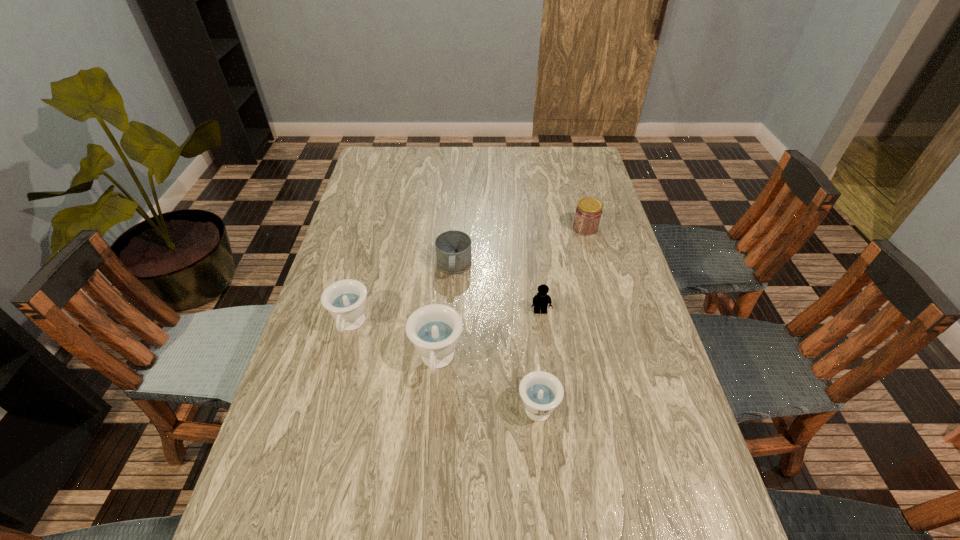
The width and height of the screenshot is (960, 540). In order to click on the leftmost object in this screenshot , I will do `click(345, 300)`.

You are a GUI agent. You are given a task and a screenshot of the screen. Output one action in this format:
    pyautogui.click(x=<x>, y=<y>)
    Task: Click on the second tallest teacup
    
    Given the screenshot: What is the action you would take?
    pyautogui.click(x=345, y=300)

Image resolution: width=960 pixels, height=540 pixels. I want to click on the second teacup from left to right, so click(434, 329).

Where is `the shortest teacup`? The width and height of the screenshot is (960, 540). the shortest teacup is located at coordinates (541, 392).

I want to click on Lego, so click(540, 301).

I want to click on jam, so click(588, 213).

Locate an element on the screen. The width and height of the screenshot is (960, 540). the rightmost object is located at coordinates (588, 213).

The width and height of the screenshot is (960, 540). I want to click on the fifth nearest object, so click(x=453, y=248).

Image resolution: width=960 pixels, height=540 pixels. What are the coordinates of `blank area located on the side of the second tallest teacup with the handle` in the screenshot? It's located at [x=324, y=427].

Find the location of a particular element. vacant area located on the side of the second teacup from right to left with the handle is located at coordinates (433, 417).